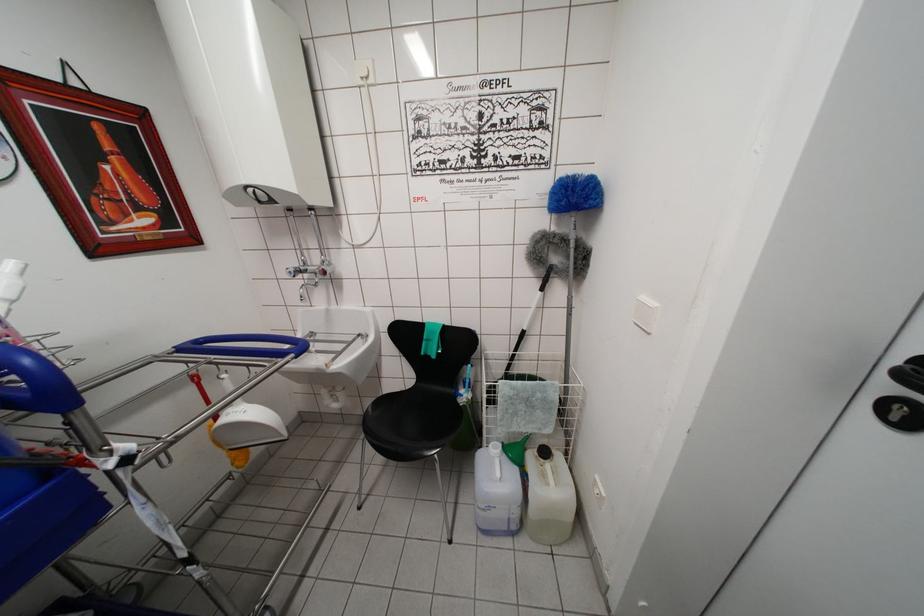
Where would you sit the chair sitting surface? Please return your answer as a coordinate pair (x, y).

(431, 422)